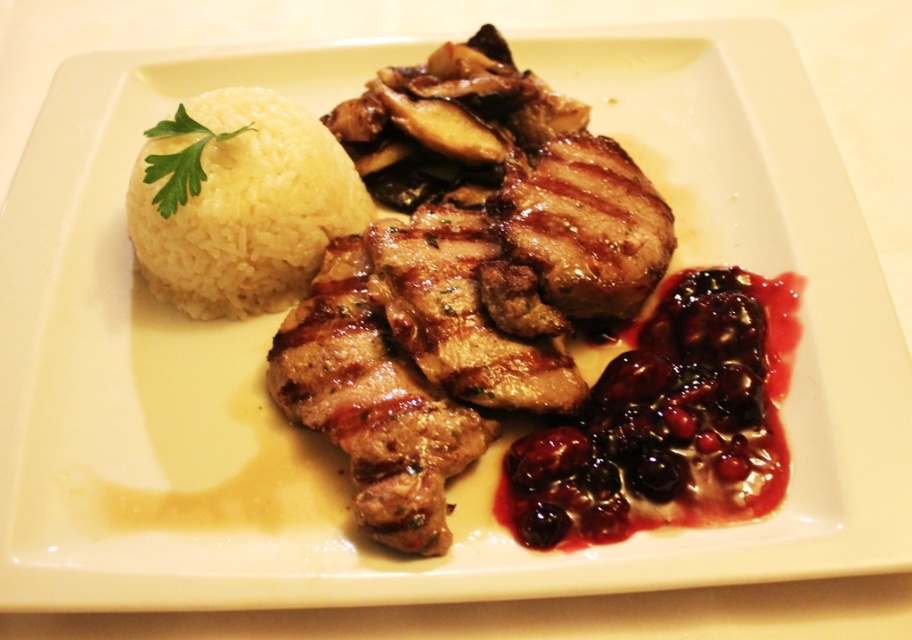
Question: Does grilled meat at center have a greater width compared to green leafy parsley at upper left?

Choices:
 (A) no
 (B) yes

Answer: (B)

Question: Can you confirm if savory berry sauce at lower right is positioned below white polished rice at upper left?

Choices:
 (A) yes
 (B) no

Answer: (A)

Question: Which object is the closest to the white polished rice at upper left?

Choices:
 (A) savory berry sauce at lower right
 (B) green leafy parsley at upper left

Answer: (B)

Question: Which point is farther to the camera?

Choices:
 (A) white polished rice at upper left
 (B) savory berry sauce at lower right
 (C) green leafy parsley at upper left

Answer: (A)

Question: Which of the following is the farthest from the observer?

Choices:
 (A) white polished rice at upper left
 (B) savory berry sauce at lower right

Answer: (A)

Question: Does grilled meat at center have a larger size compared to savory berry sauce at lower right?

Choices:
 (A) yes
 (B) no

Answer: (A)